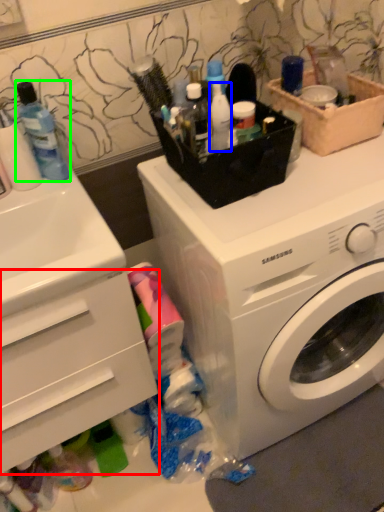
Question: Which object is the closest to the drawer (highlighted by a red box)? Choose among these: toiletry (highlighted by a blue box) or mouthwash (highlighted by a green box).

Choices:
 (A) toiletry
 (B) mouthwash

Answer: (B)